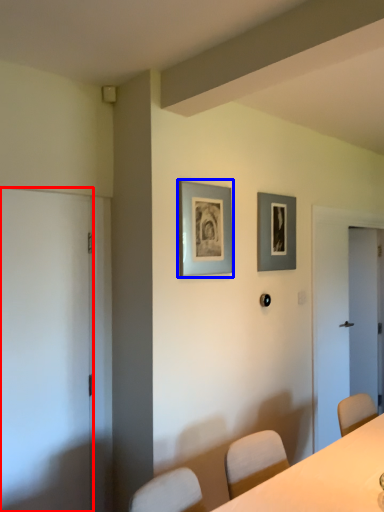
Question: Which of the following is the closest to the observer, door (highlighted by a red box) or picture frame (highlighted by a blue box)?

Choices:
 (A) door
 (B) picture frame

Answer: (A)